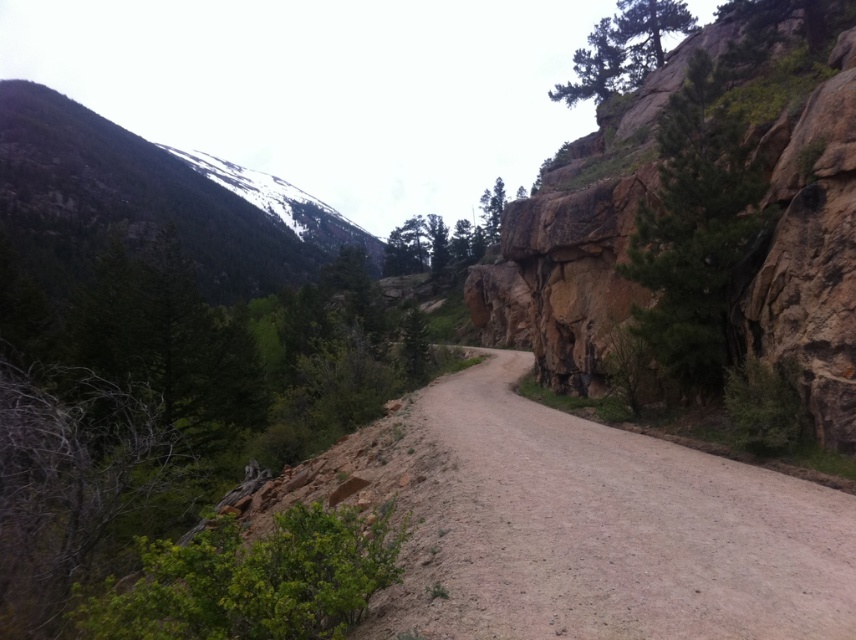
Question: Which object is farther from the camera taking this photo?

Choices:
 (A) green leafy bush at lower left
 (B) dirt/gravel road at center
 (C) green rough textured tree at right

Answer: (C)

Question: Can you confirm if dirt/gravel road at center is positioned below green rough bark tree at upper right?

Choices:
 (A) no
 (B) yes

Answer: (B)

Question: Is green rough textured tree at right smaller than green matte tree at center?

Choices:
 (A) yes
 (B) no

Answer: (A)

Question: Does green leafy bush at lower left have a lesser width compared to green rough textured tree at right?

Choices:
 (A) no
 (B) yes

Answer: (A)

Question: Among these objects, which one is nearest to the camera?

Choices:
 (A) dirt/gravel road at center
 (B) green matte tree at center

Answer: (A)

Question: Which point appears farthest from the camera in this image?

Choices:
 (A) (658, 358)
 (B) (198, 548)
 (C) (426, 241)

Answer: (C)